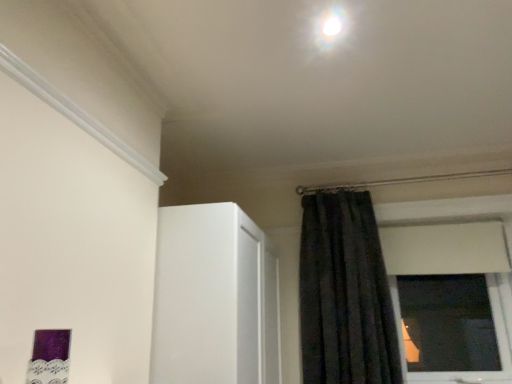
Question: Is black velvet curtain at upper right spatially inside white glossy light at upper center, or outside of it?

Choices:
 (A) inside
 (B) outside

Answer: (B)

Question: From the image's perspective, relative to white glossy light at upper center, is black velvet curtain at upper right above or below?

Choices:
 (A) above
 (B) below

Answer: (B)

Question: Does point (359, 233) appear closer or farther from the camera than point (330, 33)?

Choices:
 (A) farther
 (B) closer

Answer: (A)

Question: Relative to black velvet curtain at upper right, is white glossy light at upper center in front or behind?

Choices:
 (A) front
 (B) behind

Answer: (A)

Question: From a real-world perspective, is white glossy light at upper center above or below black velvet curtain at upper right?

Choices:
 (A) above
 (B) below

Answer: (A)

Question: From the image's perspective, is white glossy light at upper center positioned above or below black velvet curtain at upper right?

Choices:
 (A) below
 (B) above

Answer: (B)

Question: Is white glossy light at upper center wider or thinner than black velvet curtain at upper right?

Choices:
 (A) wide
 (B) thin

Answer: (B)